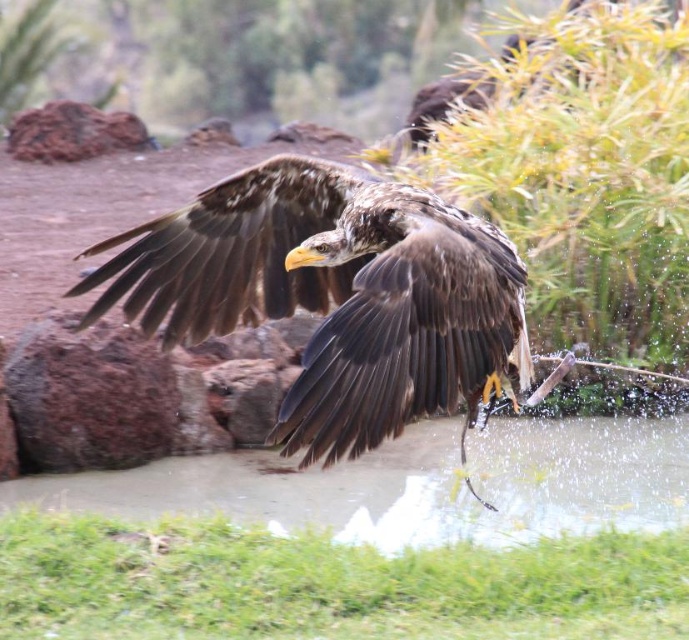
You are standing on the rocky shore and see the brown feathered eagle at center and the clear water at lower center. Which object is nearer to you?

The brown feathered eagle at center is closer to the viewer than the clear water at lower center.

You are a nature photographer observing the scene. You want to capture a photo of the brown feathered eagle at center and the clear water at lower center. Which object is positioned higher in the image?

The brown feathered eagle at center is positioned higher than the clear water at lower center in the image.

You are a photographer trying to capture the brown feathered eagle at center and the clear water at lower center in a single frame. Based on their sizes in the image, which one would you need to zoom in more on to get a detailed shot?

The brown feathered eagle at center has a lesser width compared to the clear water at lower center, so you would need to zoom in more on the brown feathered eagle at center to get a detailed shot since it is smaller in the frame.